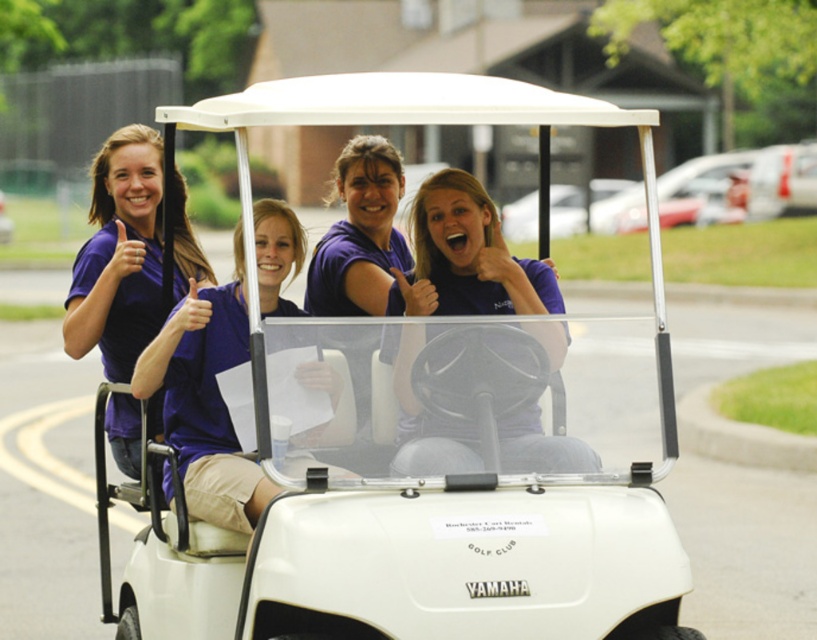
You are a photographer trying to capture a group photo of the white matte golf cart at center and the purple matte shirt at upper left. Which object should you focus on first if you want to ensure both are in the frame without moving the camera?

The white matte golf cart at center is bigger than the purple matte shirt at upper left, so you should focus on the white matte golf cart at center first to ensure it fits in the frame before adjusting for the smaller purple matte shirt at upper left.

Looking at this image, you are standing in front of the golf cart and want to take a photo. There are two points marked on the cart, one at point [297,310] and another at point [119,339]. Which point will appear closer to you in the photo?

Point [297,310] is closer to the camera than point [119,339], so it will appear closer in the photo.

You are a photographer trying to capture a group photo of the purple matte shirt at center and the white matte golf cart at center. Since you want to ensure both subjects are fully visible in the frame, which one should you position closer to the camera to avoid cropping?

The white matte golf cart at center is taller than the purple matte shirt at center, so positioning the golf cart closer to the camera will help ensure both subjects are fully visible without cropping.